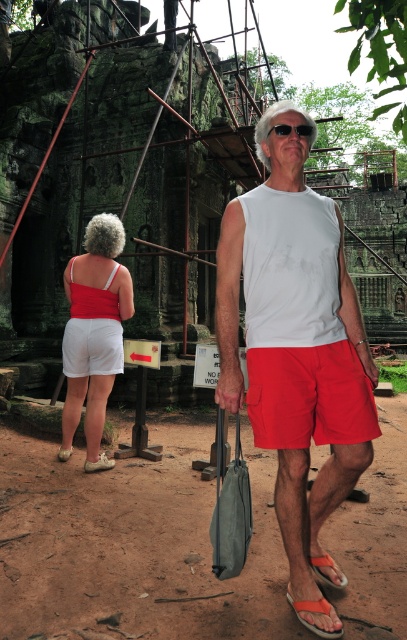
Question: Which point appears farthest from the camera in this image?

Choices:
 (A) (39, 468)
 (B) (297, 605)

Answer: (A)

Question: Which point appears closest to the camera in this image?

Choices:
 (A) (15, 432)
 (B) (94, 400)
 (C) (302, 140)
 (D) (328, 605)

Answer: (D)

Question: Which of these objects is positioned closest to the brown dirt field at center?

Choices:
 (A) white matte tank top at center
 (B) matte white shorts at lower left

Answer: (A)

Question: Is brown dirt field at center in front of orange fabric sandal at lower center?

Choices:
 (A) no
 (B) yes

Answer: (A)

Question: Is white matte tank top at center wider than orange fabric sandal at lower center?

Choices:
 (A) no
 (B) yes

Answer: (B)

Question: Is brown dirt field at center below white matte tank top at center?

Choices:
 (A) no
 (B) yes

Answer: (B)